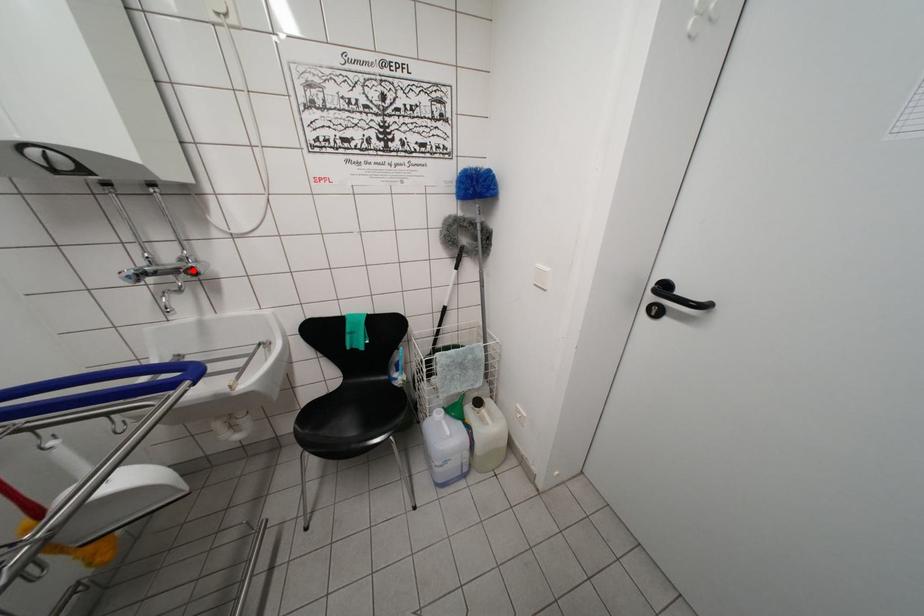
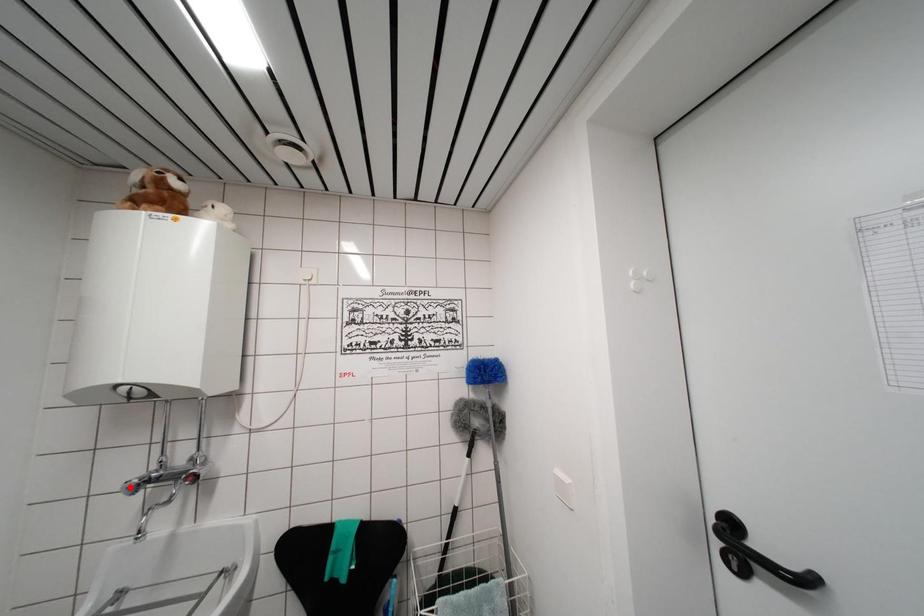
I am providing you with two images of the same scene from different viewpoints. A red point is marked on the first image and another point is marked on the second image. Is the marked point in image1 the same physical position as the marked point in image2?

No